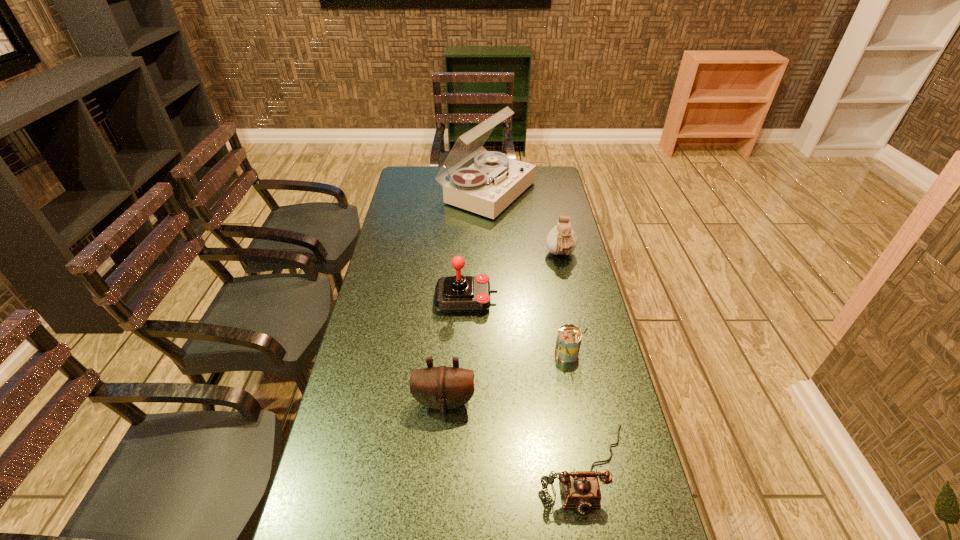
The width and height of the screenshot is (960, 540). I want to click on object that stands as the closest to the record player, so point(561,240).

Identify the location of object that is the second closest to the nearest object. Image resolution: width=960 pixels, height=540 pixels. (569, 337).

I want to click on vacant area that satisfies the following two spatial constraints: 1. on the base of the joystick; 2. on the left side of the third nearest object, so click(x=465, y=354).

Find the location of `vacant space that satisfies the following two spatial constraints: 1. on the base of the third nearest object; 2. on the right side of the third farthest object`. vacant space that satisfies the following two spatial constraints: 1. on the base of the third nearest object; 2. on the right side of the third farthest object is located at coordinates (465, 354).

Identify the location of vacant space that satisfies the following two spatial constraints: 1. on the front-facing side of the second farthest object; 2. on the base of the third farthest object. The image size is (960, 540). (570, 299).

Locate an element on the screen. Image resolution: width=960 pixels, height=540 pixels. vacant area in the image that satisfies the following two spatial constraints: 1. on the base of the fourth nearest object; 2. with the flap open on the nearer pouch is located at coordinates (463, 402).

Where is `vacant area in the image that satisfies the following two spatial constraints: 1. on the base of the joystick; 2. with the flap open on the nearer pouch`? This screenshot has height=540, width=960. vacant area in the image that satisfies the following two spatial constraints: 1. on the base of the joystick; 2. with the flap open on the nearer pouch is located at coordinates (463, 402).